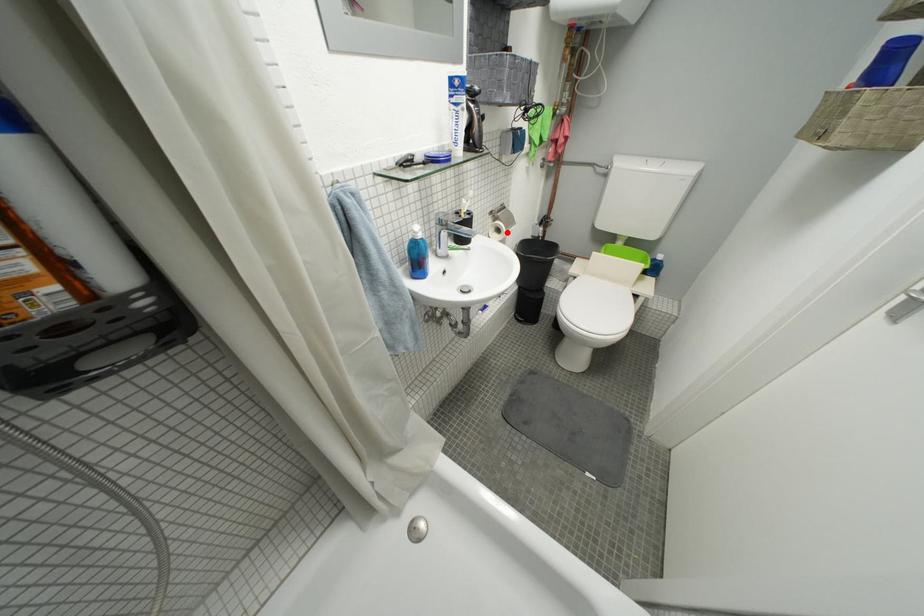
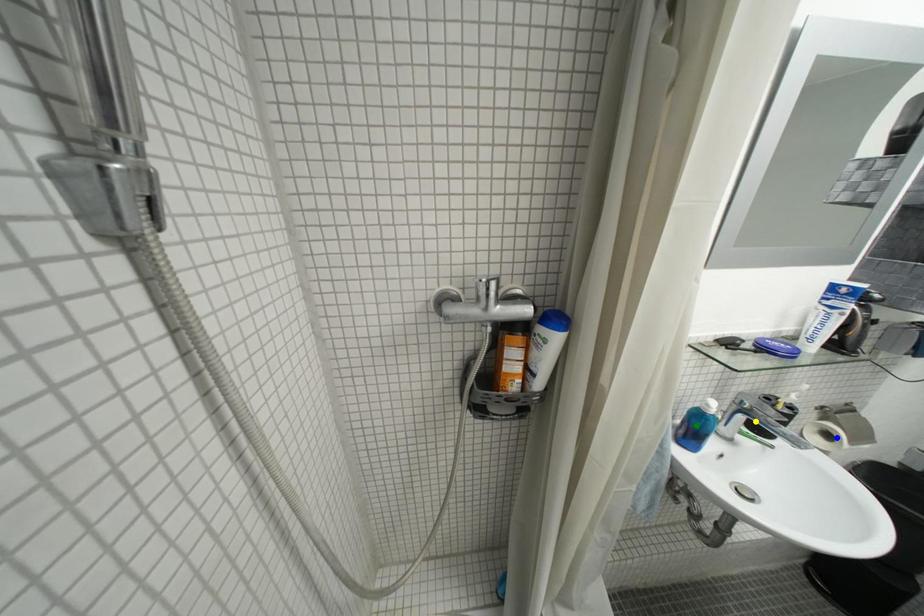
Question: I am providing you with two images of the same scene from different viewpoints. A red point is marked on the first image. You are given multiple points on the second image. Which point in image 2 represents the same 3d spot as the red point in image 1?

Choices:
 (A) blue point
 (B) green point
 (C) yellow point

Answer: (A)